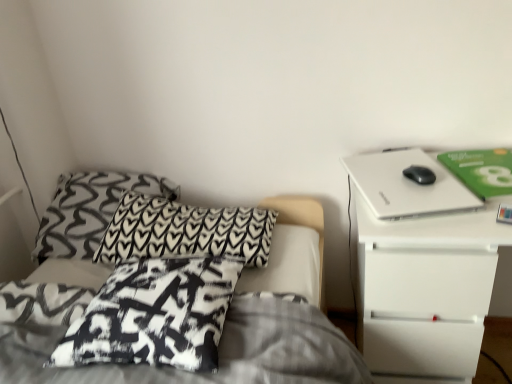
Where is `free space above white matte nightstand at right (from a real-world perspective)`? Image resolution: width=512 pixels, height=384 pixels. free space above white matte nightstand at right (from a real-world perspective) is located at coordinates (464, 182).